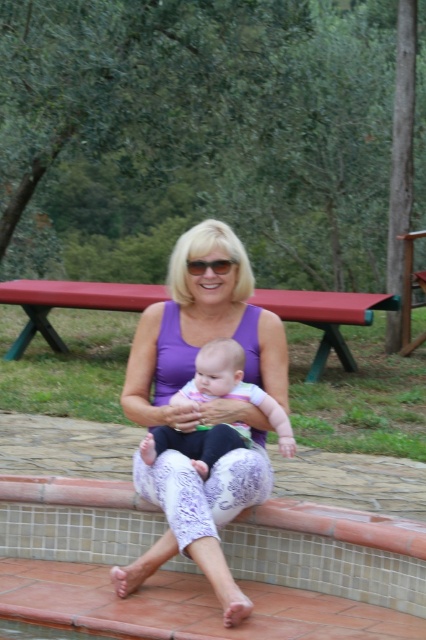
Consider the image. Can you confirm if purple lace pants at center is positioned above red painted wood picnic table at center?

No, purple lace pants at center is not above red painted wood picnic table at center.

Does purple lace pants at center have a smaller size compared to red painted wood picnic table at center?

Indeed, purple lace pants at center has a smaller size compared to red painted wood picnic table at center.

Is point (221, 232) closer to camera compared to point (336, 333)?

Yes.

Image resolution: width=426 pixels, height=640 pixels. I want to click on purple lace pants at center, so click(201, 404).

Can you confirm if red painted wood picnic table at center is positioned to the left of soft pink fabric baby at center?

Yes, red painted wood picnic table at center is to the left of soft pink fabric baby at center.

Which is behind, point (276, 310) or point (252, 392)?

Point (276, 310)

Who is more forward, (296, 292) or (282, 438)?

Point (282, 438) is in front.

You are a GUI agent. You are given a task and a screenshot of the screen. Output one action in this format:
    pyautogui.click(x=<x>, y=<y>)
    Task: Click on the red painted wood picnic table at center
    The image size is (426, 640).
    Given the screenshot: What is the action you would take?
    pyautogui.click(x=69, y=304)

Based on the photo, does purple lace pants at center have a lesser width compared to soft pink fabric baby at center?

No.

Can you confirm if purple lace pants at center is shorter than soft pink fabric baby at center?

No.

Identify the location of purple lace pants at center. The height and width of the screenshot is (640, 426). (201, 404).

Locate an element on the screen. This screenshot has height=640, width=426. purple lace pants at center is located at coordinates (201, 404).